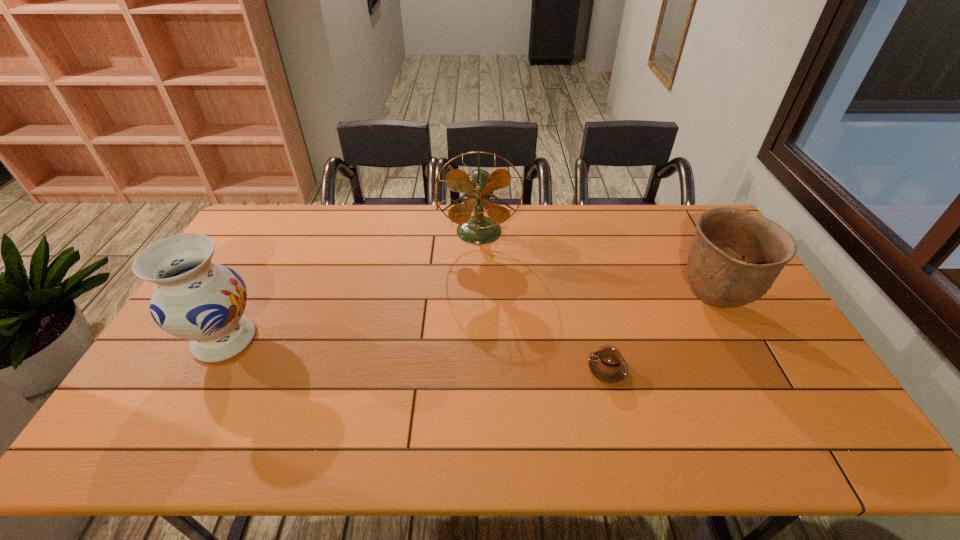
The image size is (960, 540). What are the coordinates of `unoccupied area between the vase and the second object from right to left` in the screenshot? It's located at (416, 355).

You are a GUI agent. You are given a task and a screenshot of the screen. Output one action in this format:
    pyautogui.click(x=<x>, y=<y>)
    Task: Click on the object that stands as the third closest to the fan
    The width and height of the screenshot is (960, 540).
    Given the screenshot: What is the action you would take?
    pyautogui.click(x=195, y=299)

Locate which object ranks third in proximity to the pottery. Please provide its 2D coordinates. Your answer should be formatted as a tuple, i.e. [(x, y)], where the tuple contains the x and y coordinates of a point satisfying the conditions above.

[(195, 299)]

Identify the location of free point that satisfies the following two spatial constraints: 1. in front of the fan, directing air flow; 2. on the left side of the pottery. pyautogui.click(x=479, y=301).